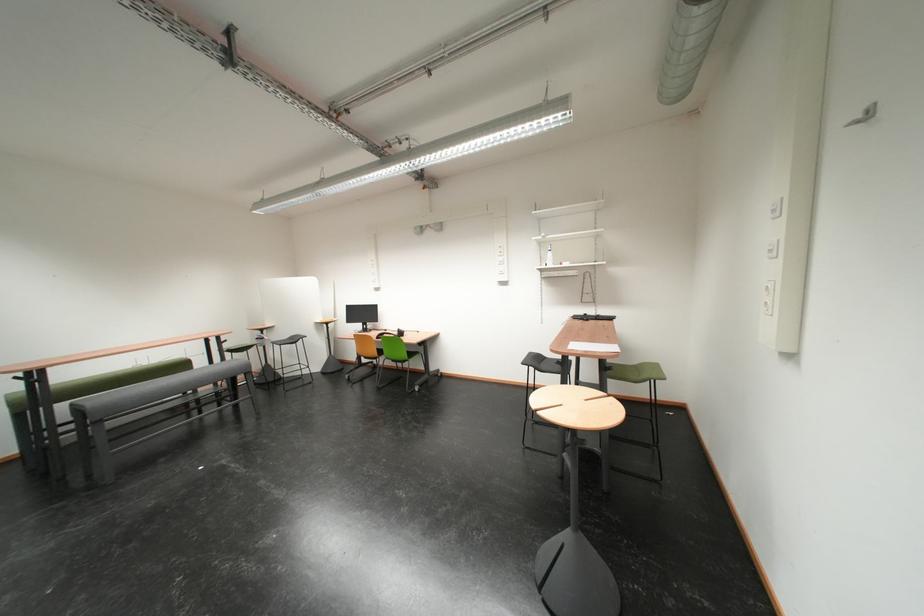
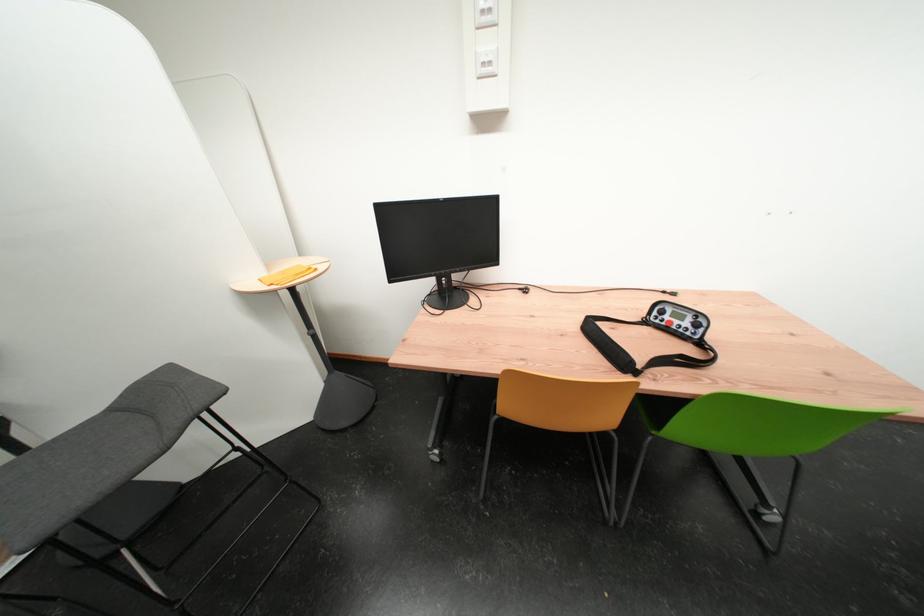
From the picture: In a continuous first-person perspective shot, in which direction is the camera moving?

The movement direction of the cameraman is left, forward.